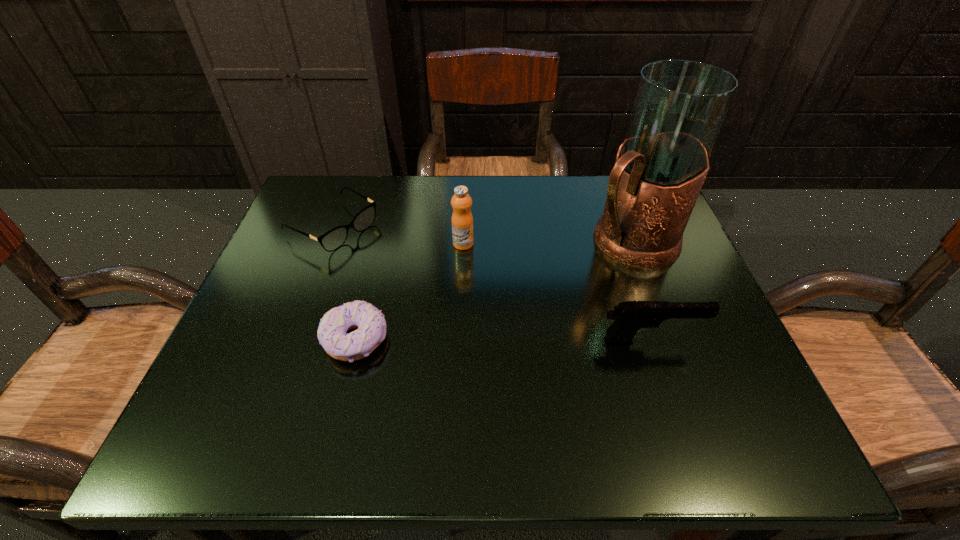
Locate an element on the screen. This screenshot has height=540, width=960. pistol present at the right edge is located at coordinates (630, 316).

Identify the location of pitcher present at the right edge. (679, 107).

Where is `object that is at the far left corner`? This screenshot has width=960, height=540. object that is at the far left corner is located at coordinates (333, 239).

I want to click on object that is at the far right corner, so click(679, 107).

In the image, there is a desktop. Find the location of `vacant space at the far edge`. vacant space at the far edge is located at coordinates (538, 202).

I want to click on vacant space at the near edge of the desktop, so click(451, 375).

Locate an element on the screen. The width and height of the screenshot is (960, 540). vacant region at the left edge of the desktop is located at coordinates (293, 282).

In the image, there is a desktop. Where is `vacant space at the right edge`? This screenshot has height=540, width=960. vacant space at the right edge is located at coordinates (684, 264).

Where is `free space at the far left corner of the desktop`? This screenshot has width=960, height=540. free space at the far left corner of the desktop is located at coordinates (360, 211).

At what (x,y) coordinates should I click in order to perform the action: click on free space at the near left corner of the desktop. Please return your answer as a coordinate pair (x, y). The height and width of the screenshot is (540, 960). Looking at the image, I should click on (305, 364).